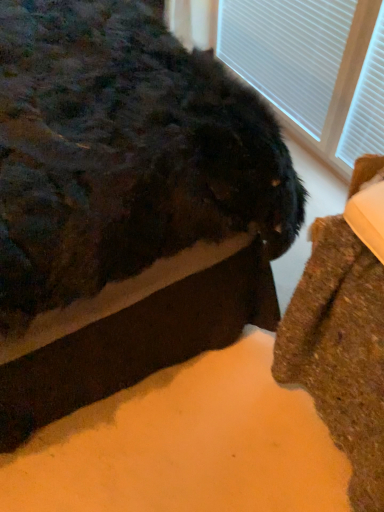
Question: Is fuzzy black cat at lower right to the left of brown textured rug at lower right from the viewer's perspective?

Choices:
 (A) no
 (B) yes

Answer: (B)

Question: Can you confirm if fuzzy black cat at lower right is shorter than brown textured rug at lower right?

Choices:
 (A) no
 (B) yes

Answer: (A)

Question: Is fuzzy black cat at lower right taller than brown textured rug at lower right?

Choices:
 (A) yes
 (B) no

Answer: (A)

Question: Can you confirm if fuzzy black cat at lower right is wider than brown textured rug at lower right?

Choices:
 (A) yes
 (B) no

Answer: (A)

Question: From a real-world perspective, is fuzzy black cat at lower right physically below brown textured rug at lower right?

Choices:
 (A) no
 (B) yes

Answer: (A)

Question: Visually, is brown textured rug at lower right positioned to the left or to the right of white textured blinds at upper right?

Choices:
 (A) left
 (B) right

Answer: (B)

Question: From a real-world perspective, is brown textured rug at lower right positioned above or below white textured blinds at upper right?

Choices:
 (A) above
 (B) below

Answer: (B)

Question: Is point (339, 372) positioned closer to the camera than point (334, 31)?

Choices:
 (A) closer
 (B) farther

Answer: (A)

Question: Is brown textured rug at lower right taller or shorter than white textured blinds at upper right?

Choices:
 (A) tall
 (B) short

Answer: (A)

Question: Is point (102, 138) positioned closer to the camera than point (312, 34)?

Choices:
 (A) closer
 (B) farther

Answer: (A)

Question: Looking at their shapes, would you say fuzzy black cat at lower right is wider or thinner than white textured blinds at upper right?

Choices:
 (A) thin
 (B) wide

Answer: (B)

Question: Is fuzzy black cat at lower right taller or shorter than white textured blinds at upper right?

Choices:
 (A) short
 (B) tall

Answer: (B)

Question: In the image, is fuzzy black cat at lower right on the left side or the right side of white textured blinds at upper right?

Choices:
 (A) right
 (B) left

Answer: (B)

Question: From the image's perspective, relative to brown textured rug at lower right, is white textured blinds at upper right above or below?

Choices:
 (A) below
 (B) above

Answer: (B)

Question: Looking at their shapes, would you say white textured blinds at upper right is wider or thinner than brown textured rug at lower right?

Choices:
 (A) thin
 (B) wide

Answer: (A)